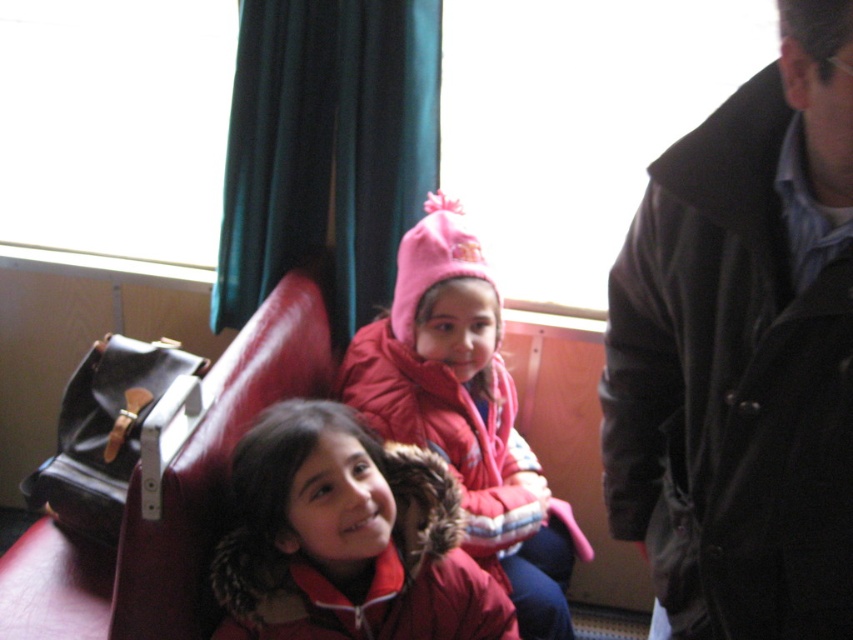
You are a photographer standing in the train compartment. You want to take a photo of the black leather jacket at upper right and the red fleece jacket at center. How far apart are these two jackets from each other?

The black leather jacket at upper right is 24.39 inches away from the red fleece jacket at center.

You are a photographer trying to capture a clear photo of both the fuzzy red jacket at center and the pink fleece hat at center. Since the camera can only focus on one object at a time, which one should you choose to ensure the other is still somewhat in focus?

Since the fuzzy red jacket at center is closer to the viewer than pink fleece hat at center, focusing on the fuzzy red jacket at center will keep the pink fleece hat at center more in focus than if you focused on the hat. However, depth of field may vary depending on camera settings.

You are a photographer trying to capture a photo of the two children sitting on the red bench. You want to ensure that both the fuzzy red jacket at center and the pink fleece hat at center are clearly visible in the frame. Based on their positions, which one is closer to the camera?

The fuzzy red jacket at center is positioned under the pink fleece hat at center, meaning the pink fleece hat at center is closer to the camera.